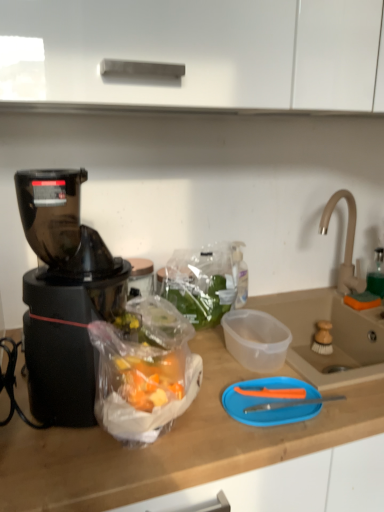
Describe the element at coordinates (337, 322) in the screenshot. I see `beige ceramic sink at right, which is counted as the first sink, starting from the top` at that location.

Measure the distance between black plastic blender at left and camera.

27.28 inches.

Measure the distance between point (345,324) and camera.

The depth of point (345,324) is 4.34 feet.

The image size is (384, 512). What do you see at coordinates (332, 336) in the screenshot?
I see `transparent plastic sink at right, arranged as the second sink when viewed from the top` at bounding box center [332, 336].

What are the coordinates of `white matte cabinet at upper center` in the screenshot? It's located at (196, 52).

Who is bigger, white matte cabinet at upper center or black plastic blender at left?

Bigger between the two is white matte cabinet at upper center.

The height and width of the screenshot is (512, 384). In order to click on blender below the white matte cabinet at upper center (from the image's perspective) in this screenshot , I will do `click(64, 296)`.

Considering the relative positions of white matte cabinet at upper center and black plastic blender at left in the image provided, is white matte cabinet at upper center to the left or to the right of black plastic blender at left?

white matte cabinet at upper center is to the right of black plastic blender at left.

From a real-world perspective, does transparent plastic sink at right, arranged as the second sink when viewed from the top, stand above blue plastic cutting board at center?

Actually, transparent plastic sink at right, arranged as the second sink when viewed from the top, is physically below blue plastic cutting board at center in the real world.

Which of these two, transparent plastic sink at right, arranged as the second sink when viewed from the top, or blue plastic cutting board at center, is smaller?

blue plastic cutting board at center is smaller.

Is transparent plastic sink at right, acting as the 1th sink starting from the bottom, shorter than blue plastic cutting board at center?

In fact, transparent plastic sink at right, acting as the 1th sink starting from the bottom, may be taller than blue plastic cutting board at center.

At what (x,y) coordinates should I click in order to perform the action: click on the 1st sink behind the white matte cabinet at upper center, counting from the anchor's position. Please return your answer as a coordinate pair (x, y). The height and width of the screenshot is (512, 384). Looking at the image, I should click on (x=332, y=336).

Considering the relative sizes of transparent plastic sink at right, acting as the 1th sink starting from the bottom, and white matte cabinet at upper center in the image provided, is transparent plastic sink at right, acting as the 1th sink starting from the bottom, wider than white matte cabinet at upper center?

Correct, the width of transparent plastic sink at right, acting as the 1th sink starting from the bottom, exceeds that of white matte cabinet at upper center.

Considering the positions of objects transparent plastic sink at right, arranged as the second sink when viewed from the top, and white matte cabinet at upper center in the image provided, who is more to the right, transparent plastic sink at right, arranged as the second sink when viewed from the top, or white matte cabinet at upper center?

transparent plastic sink at right, arranged as the second sink when viewed from the top, is more to the right.

Is transparent plastic sink at right, arranged as the second sink when viewed from the top, facing away from white matte cabinet at upper center?

No.

This screenshot has width=384, height=512. In order to click on sink that is the 2nd one below the black plastic blender at left (from a real-world perspective) in this screenshot , I will do `click(332, 336)`.

Does black plastic blender at left have a larger size compared to transparent plastic sink at right, arranged as the second sink when viewed from the top?

Yes, black plastic blender at left is bigger than transparent plastic sink at right, arranged as the second sink when viewed from the top.

Which object is positioned more to the left, black plastic blender at left or transparent plastic sink at right, acting as the 1th sink starting from the bottom?

From the viewer's perspective, black plastic blender at left appears more on the left side.

From a real-world perspective, who is located lower, black plastic blender at left or transparent plastic sink at right, acting as the 1th sink starting from the bottom?

transparent plastic sink at right, acting as the 1th sink starting from the bottom.

From a real-world perspective, is transparent plastic sink at right, acting as the 1th sink starting from the bottom, over black plastic blender at left?

Actually, transparent plastic sink at right, acting as the 1th sink starting from the bottom, is physically below black plastic blender at left in the real world.

Which object is closer to the camera, transparent plastic sink at right, acting as the 1th sink starting from the bottom, or black plastic blender at left?

Positioned in front is black plastic blender at left.

Looking at this image, can you confirm if transparent plastic sink at right, acting as the 1th sink starting from the bottom, is shorter than black plastic blender at left?

Correct, transparent plastic sink at right, acting as the 1th sink starting from the bottom, is not as tall as black plastic blender at left.

How distant is transparent plastic sink at right, acting as the 1th sink starting from the bottom, from black plastic blender at left?

They are 27.92 inches apart.

Where is `the 1st sink below the white matte cabinet at upper center (from a real-world perspective)`? The height and width of the screenshot is (512, 384). the 1st sink below the white matte cabinet at upper center (from a real-world perspective) is located at coordinates (337, 322).

From the image's perspective, is beige ceramic sink at right, which is counted as the first sink, starting from the top, located above or below white matte cabinet at upper center?

From the image's perspective, beige ceramic sink at right, which is counted as the first sink, starting from the top, appears below white matte cabinet at upper center.

Are beige ceramic sink at right, which is counted as the first sink, starting from the top, and white matte cabinet at upper center located far from each other?

beige ceramic sink at right, which is counted as the first sink, starting from the top, is actually quite close to white matte cabinet at upper center.

Considering the positions of objects beige ceramic sink at right, the 2th sink ordered from the bottom, and white matte cabinet at upper center in the image provided, who is more to the left, beige ceramic sink at right, the 2th sink ordered from the bottom, or white matte cabinet at upper center?

white matte cabinet at upper center.

Considering the points (372, 330) and (276, 386), which point is in front, point (372, 330) or point (276, 386)?

The point (276, 386) is in front.

From the image's perspective, is beige ceramic sink at right, which is counted as the first sink, starting from the top, under blue plastic cutting board at center?

No, from the image's perspective, beige ceramic sink at right, which is counted as the first sink, starting from the top, is not beneath blue plastic cutting board at center.

Looking at the image, does beige ceramic sink at right, the 2th sink ordered from the bottom, seem bigger or smaller compared to blue plastic cutting board at center?

beige ceramic sink at right, the 2th sink ordered from the bottom, is bigger than blue plastic cutting board at center.

Find the location of a particular element. cabinetry that is above the black plastic blender at left (from the image's perspective) is located at coordinates (196, 52).

Where is `cutting board that is in front of the transparent plastic sink at right, acting as the 1th sink starting from the bottom`? cutting board that is in front of the transparent plastic sink at right, acting as the 1th sink starting from the bottom is located at coordinates [x=269, y=402].

From the image, which object appears to be farther from beige ceramic sink at right, which is counted as the first sink, starting from the top, blue plastic cutting board at center or white matte cabinet at upper center?

white matte cabinet at upper center.

Which object lies further to the anchor point white matte cabinet at upper center, beige ceramic sink at right, which is counted as the first sink, starting from the top, or black plastic blender at left?

beige ceramic sink at right, which is counted as the first sink, starting from the top, lies further to white matte cabinet at upper center than the other object.

Based on the photo, looking at the image, which one is located closer to transparent plastic sink at right, acting as the 1th sink starting from the bottom, black plastic blender at left or white matte cabinet at upper center?

black plastic blender at left is positioned closer to the anchor transparent plastic sink at right, acting as the 1th sink starting from the bottom.

Estimate the real-world distances between objects in this image. Which object is further from white matte cabinet at upper center, beige ceramic sink at right, the 2th sink ordered from the bottom, or blue plastic cutting board at center?

The object further to white matte cabinet at upper center is beige ceramic sink at right, the 2th sink ordered from the bottom.

Estimate the real-world distances between objects in this image. Which object is closer to transparent plastic sink at right, acting as the 1th sink starting from the bottom, white matte cabinet at upper center or blue plastic cutting board at center?

blue plastic cutting board at center lies closer to transparent plastic sink at right, acting as the 1th sink starting from the bottom, than the other object.

From the image, which object appears to be nearer to beige ceramic sink at right, the 2th sink ordered from the bottom, white matte cabinet at upper center or black plastic blender at left?

The object closer to beige ceramic sink at right, the 2th sink ordered from the bottom, is white matte cabinet at upper center.

When comparing their distances from beige ceramic sink at right, the 2th sink ordered from the bottom, does white matte cabinet at upper center or transparent plastic sink at right, arranged as the second sink when viewed from the top, seem closer?

transparent plastic sink at right, arranged as the second sink when viewed from the top, lies closer to beige ceramic sink at right, the 2th sink ordered from the bottom, than the other object.

When comparing their distances from transparent plastic sink at right, arranged as the second sink when viewed from the top, does blue plastic cutting board at center or black plastic blender at left seem closer?

Based on the image, blue plastic cutting board at center appears to be nearer to transparent plastic sink at right, arranged as the second sink when viewed from the top.

Identify the location of cutting board between black plastic blender at left and transparent plastic sink at right, acting as the 1th sink starting from the bottom. (269, 402).

Locate an element on the screen. The image size is (384, 512). sink between white matte cabinet at upper center and transparent plastic sink at right, arranged as the second sink when viewed from the top, vertically is located at coordinates (337, 322).

Identify the location of sink located between black plastic blender at left and transparent plastic sink at right, acting as the 1th sink starting from the bottom, in the left-right direction. (337, 322).

Locate an element on the screen. The width and height of the screenshot is (384, 512). blender that lies between white matte cabinet at upper center and blue plastic cutting board at center from top to bottom is located at coordinates (64, 296).